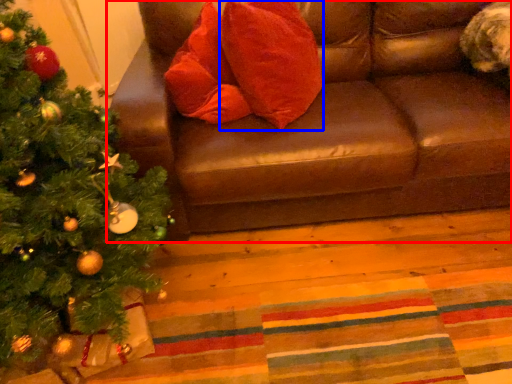
Question: Which of the following is the farthest to the observer, studio couch (highlighted by a red box) or throw pillow (highlighted by a blue box)?

Choices:
 (A) studio couch
 (B) throw pillow

Answer: (B)